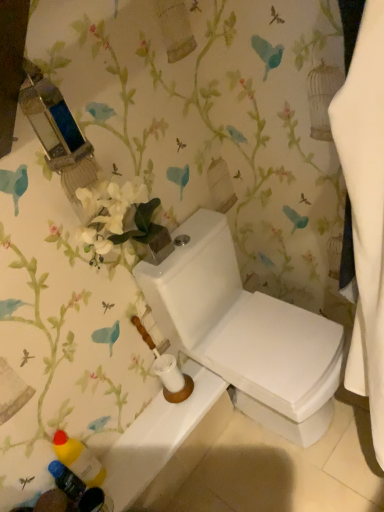
Where is `free space to the right of translucent plastic bottles at lower left, which ranks as the second toiletry in bottom-to-top order`? Image resolution: width=384 pixels, height=512 pixels. free space to the right of translucent plastic bottles at lower left, which ranks as the second toiletry in bottom-to-top order is located at coordinates (143, 452).